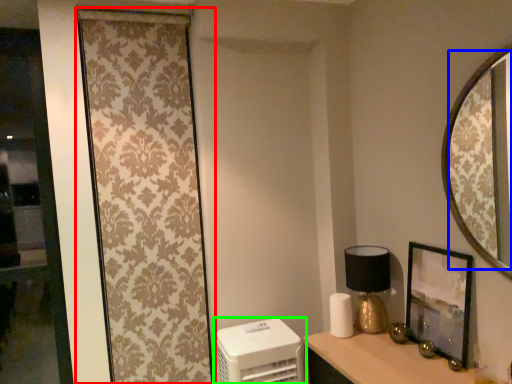
Question: Estimate the real-world distances between objects in this image. Which object is closer to curtain (highlighted by a red box), mirror (highlighted by a blue box) or appliance (highlighted by a green box)?

Choices:
 (A) mirror
 (B) appliance

Answer: (B)